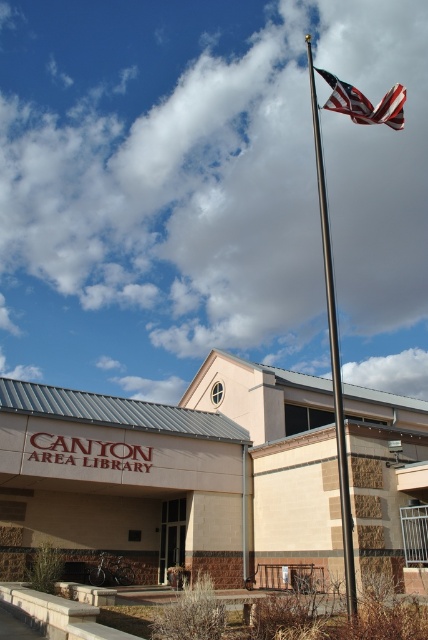
Who is higher up, polished metal flag pole at upper center or american flag at upper center?

american flag at upper center is above.

Between point (315, 138) and point (380, 100), which one is positioned behind?

Point (380, 100)

Which is behind, point (341, 426) or point (335, 93)?

Positioned behind is point (335, 93).

Locate an element on the screen. Image resolution: width=428 pixels, height=640 pixels. polished metal flag pole at upper center is located at coordinates (333, 355).